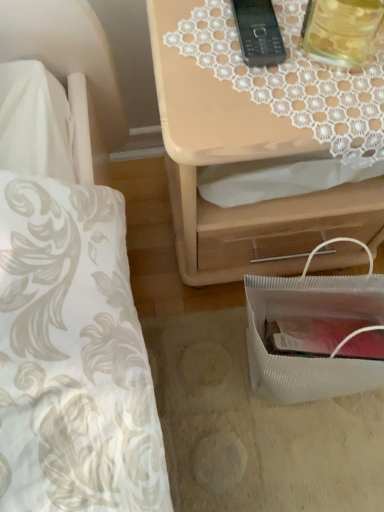
Question: From a real-world perspective, relative to translucent glass jar at upper right, is black plastic phone at upper center vertically above or below?

Choices:
 (A) below
 (B) above

Answer: (A)

Question: Is black plastic phone at upper center in front of or behind translucent glass jar at upper right in the image?

Choices:
 (A) front
 (B) behind

Answer: (B)

Question: Which is nearer to the white textured bag at lower right?

Choices:
 (A) translucent glass jar at upper right
 (B) black plastic phone at upper center
 (C) light wood/texture nightstand at upper right

Answer: (C)

Question: Considering the real-world distances, which object is closest to the white textured bag at lower right?

Choices:
 (A) translucent glass jar at upper right
 (B) light wood/texture nightstand at upper right
 (C) black plastic phone at upper center

Answer: (B)